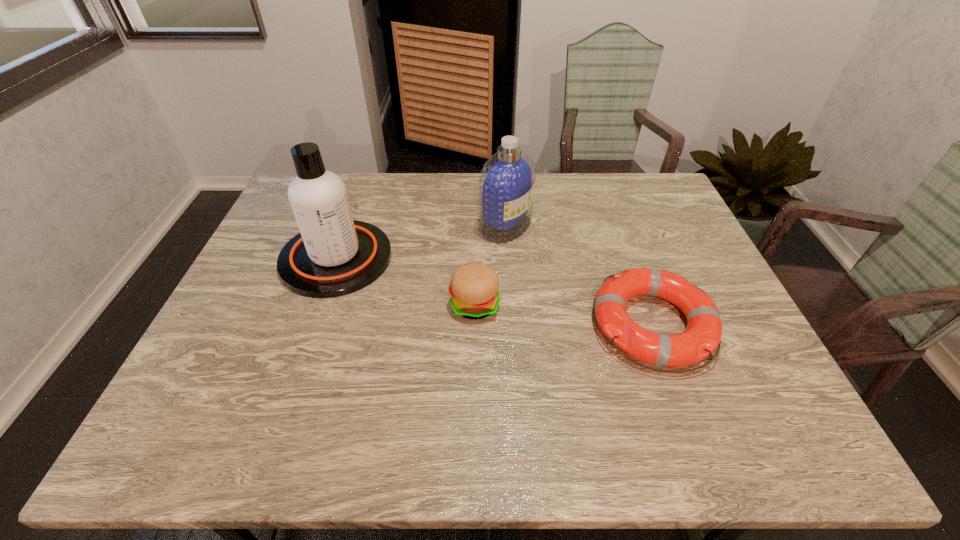
Identify the location of vacant region located on the left of the life buoy. The height and width of the screenshot is (540, 960). click(x=560, y=324).

Locate an element on the screen. object located at the far edge is located at coordinates (507, 179).

I want to click on object that is at the left edge, so click(x=333, y=255).

Where is `object that is at the right edge`? The height and width of the screenshot is (540, 960). object that is at the right edge is located at coordinates (700, 339).

In the image, there is a desktop. At what (x,y) coordinates should I click in order to perform the action: click on vacant area at the far edge. Please return your answer as a coordinate pair (x, y). This screenshot has height=540, width=960. Looking at the image, I should click on (624, 213).

Locate an element on the screen. This screenshot has height=540, width=960. vacant point at the near edge is located at coordinates (633, 446).

The height and width of the screenshot is (540, 960). What are the coordinates of `free point at the left edge` in the screenshot? It's located at (250, 326).

In the image, there is a desktop. At what (x,y) coordinates should I click in order to perform the action: click on vacant space at the right edge. Please return your answer as a coordinate pair (x, y). This screenshot has height=540, width=960. Looking at the image, I should click on (669, 307).

Find the location of a particular element. The width and height of the screenshot is (960, 540). free point between the taller cleansing agent and the third tallest object is located at coordinates (405, 281).

I want to click on free space between the shorter cleansing agent and the hamburger, so [491, 265].